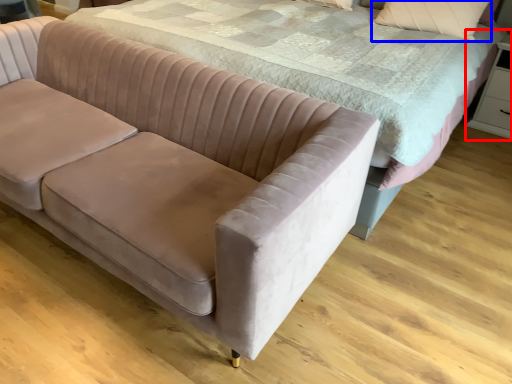
Question: Which object is further to the camera taking this photo, dresser (highlighted by a red box) or pillow (highlighted by a blue box)?

Choices:
 (A) dresser
 (B) pillow

Answer: (A)